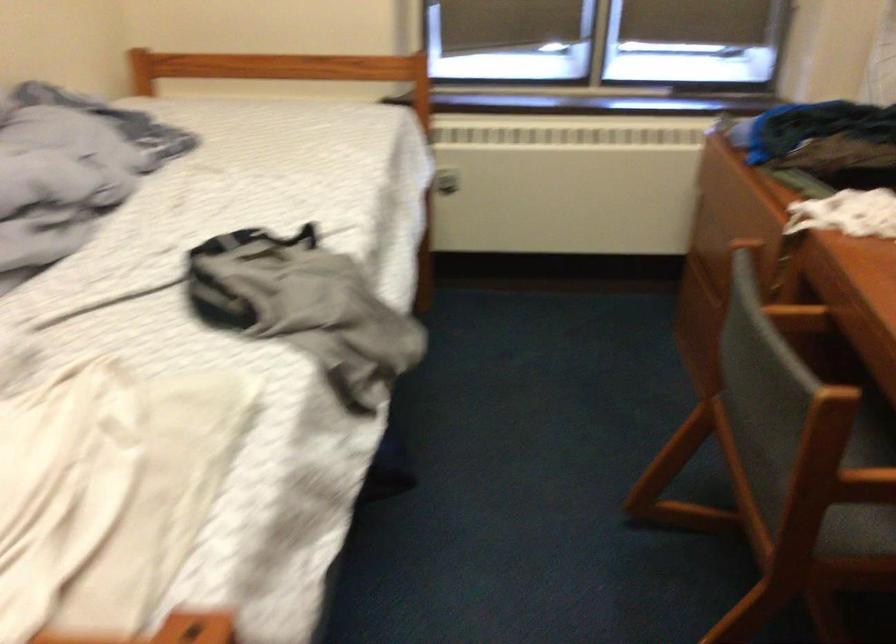
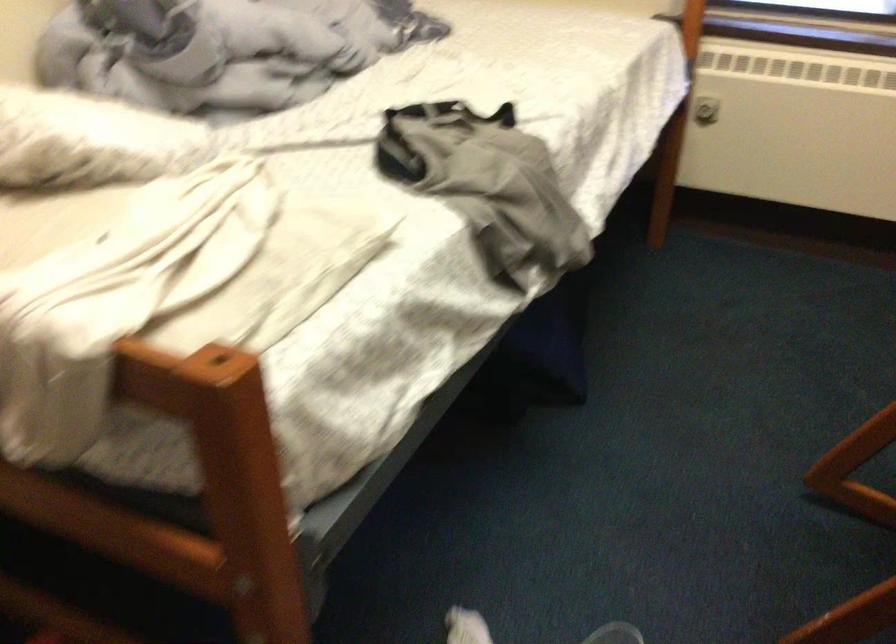
Question: The camera is either moving clockwise (left) or counter-clockwise (right) around the object. The first image is from the beginning of the video and the second image is from the end. Is the camera moving left or right when shooting the video?

Choices:
 (A) Left
 (B) Right

Answer: (B)